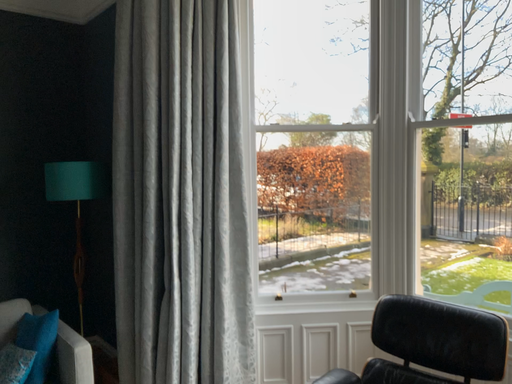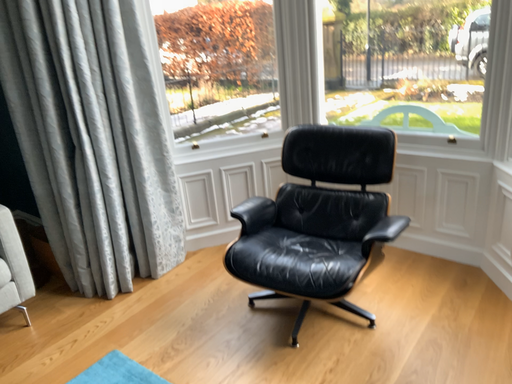
Question: How did the camera likely rotate when shooting the video?

Choices:
 (A) rotated right
 (B) rotated left

Answer: (A)